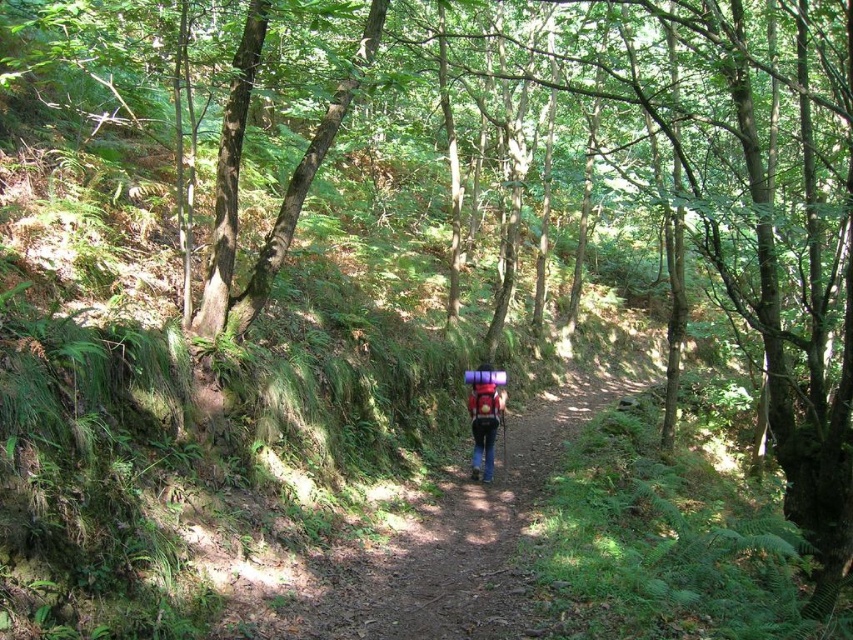
Does brown dirt path at center have a lesser height compared to matte pink backpack at center?

In fact, brown dirt path at center may be taller than matte pink backpack at center.

From the picture: Who is more distant from viewer, (567, 387) or (483, 392)?

Positioned behind is point (567, 387).

Which is behind, point (316, 572) or point (492, 371)?

The point (492, 371) is behind.

You are a GUI agent. You are given a task and a screenshot of the screen. Output one action in this format:
    pyautogui.click(x=<x>, y=<y>)
    Task: Click on the brown dirt path at center
    The image size is (853, 640).
    Given the screenshot: What is the action you would take?
    pyautogui.click(x=460, y=525)